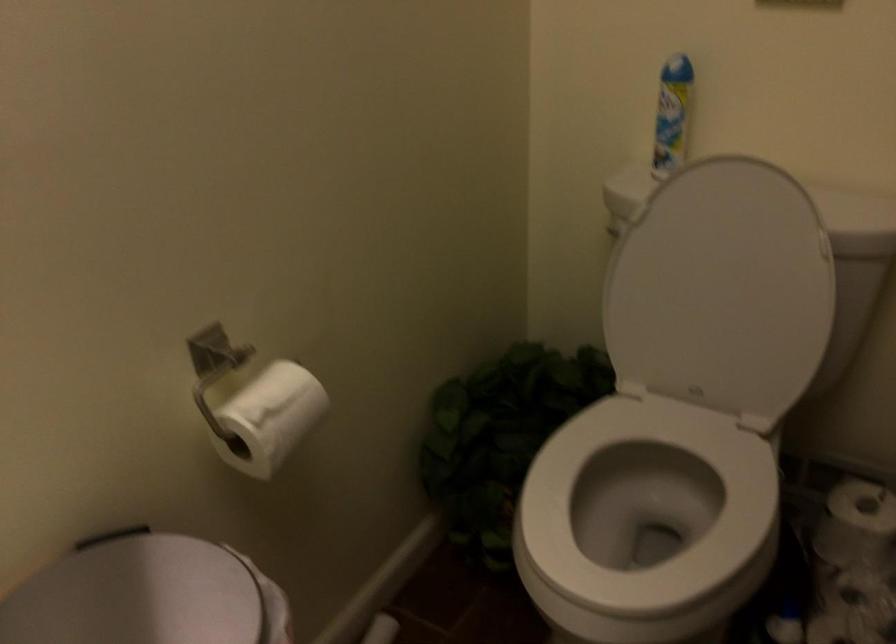
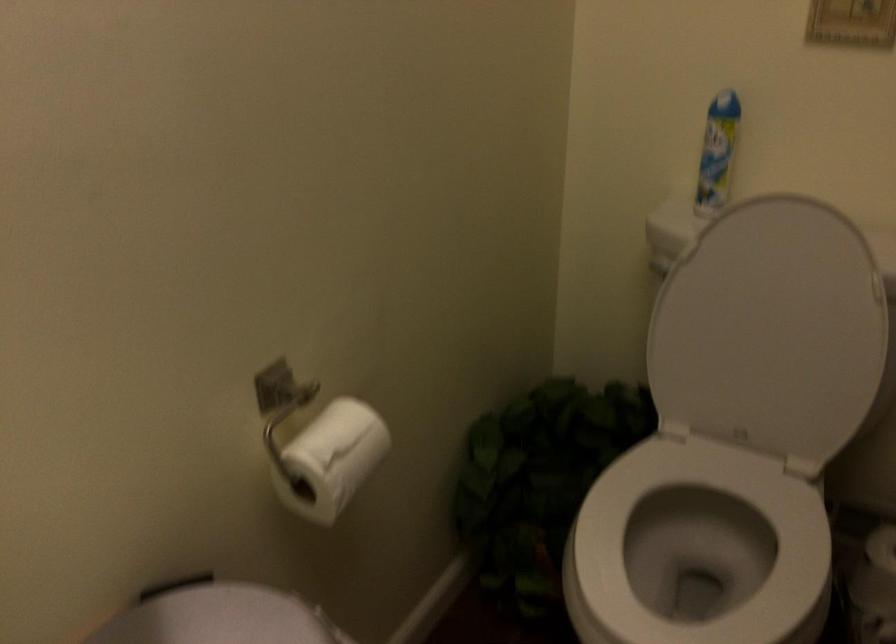
Locate, in the second image, the point that corresponds to pixel 725 289 in the first image.

(771, 330)